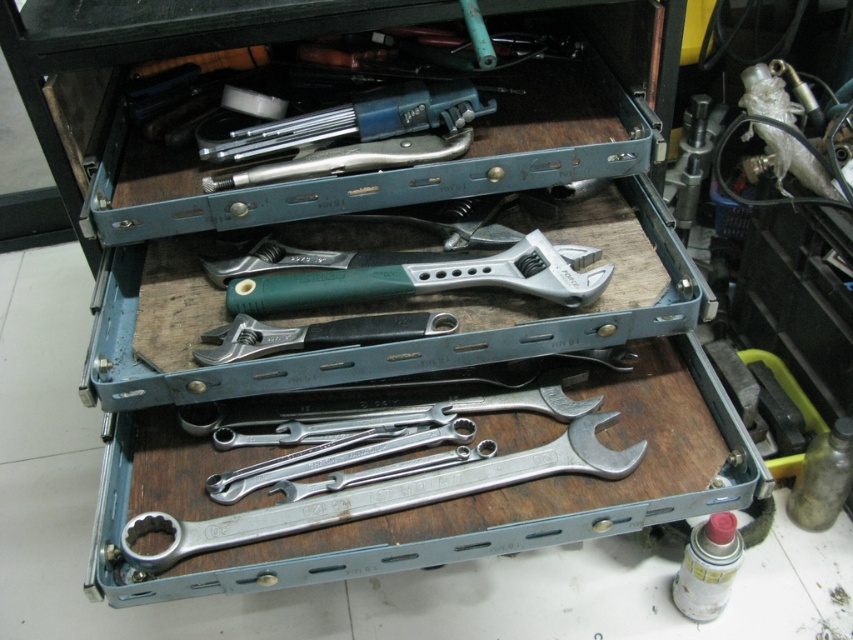
Question: Which object appears closest to the camera in this image?

Choices:
 (A) blue plastic drill bit at upper center
 (B) silver metallic wrenches at center
 (C) metallic silver wrench at center

Answer: (B)

Question: Can you confirm if blue plastic drill bit at upper center is smaller than metallic silver wrench at center?

Choices:
 (A) yes
 (B) no

Answer: (B)

Question: Which point is closer to the camera?

Choices:
 (A) metallic silver wrench at center
 (B) green plastic adjustable wrench at center
 (C) blue plastic drill bit at upper center

Answer: (B)

Question: Can you confirm if green plastic adjustable wrench at center is positioned above silver metallic wrenches at center?

Choices:
 (A) yes
 (B) no

Answer: (A)

Question: In this image, where is green plastic adjustable wrench at center located relative to black rubberized wrench at center?

Choices:
 (A) above
 (B) below

Answer: (A)

Question: Which of these objects is positioned farthest from the silver metallic wrench at center?

Choices:
 (A) silver metallic wrenches at center
 (B) blue plastic drill bit at upper center
 (C) metallic silver wrench at center

Answer: (B)